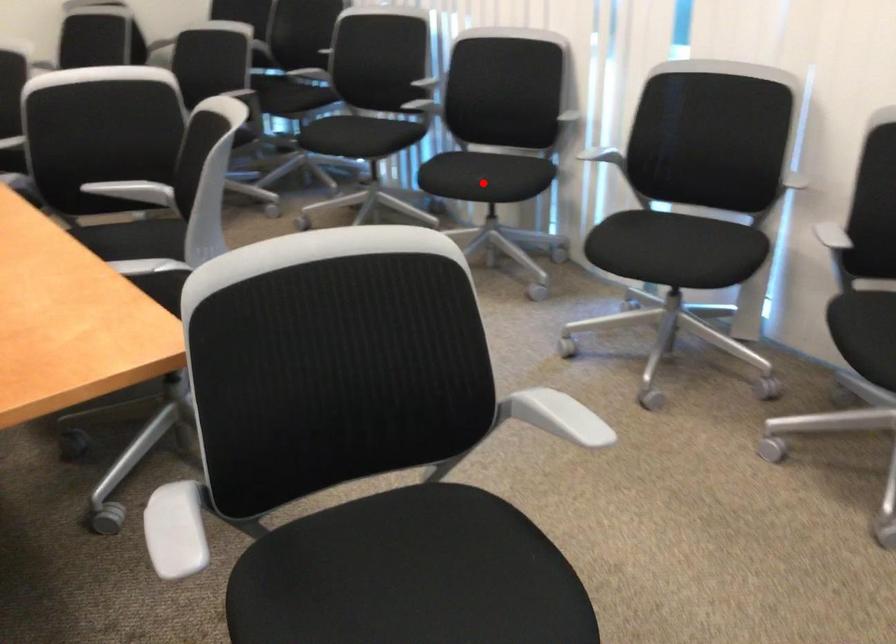
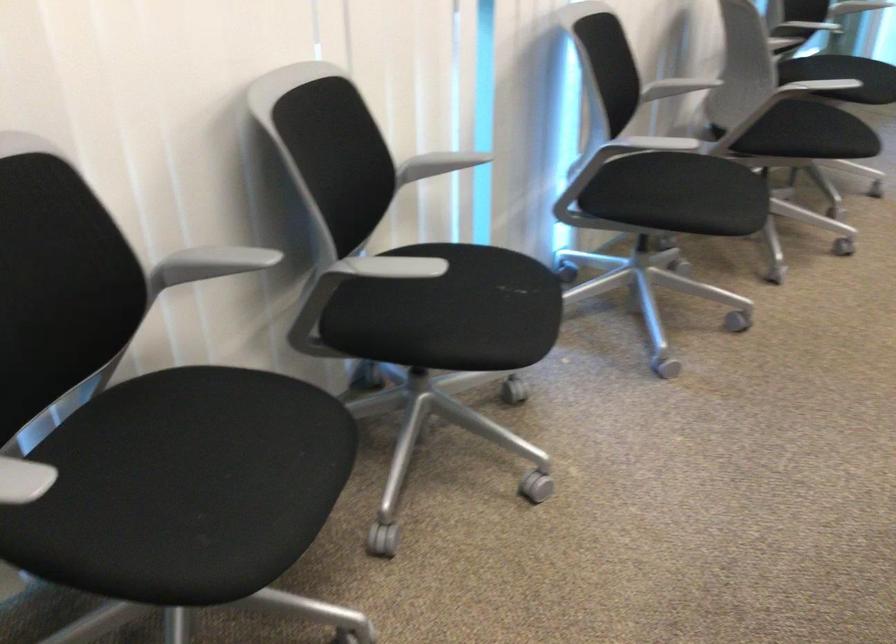
Question: I am providing you with two images of the same scene from different viewpoints. In image1, a red point is highlighted. Considering the same 3D point in image2, which of the following is correct?

Choices:
 (A) It is closer
 (B) It is farther

Answer: (A)